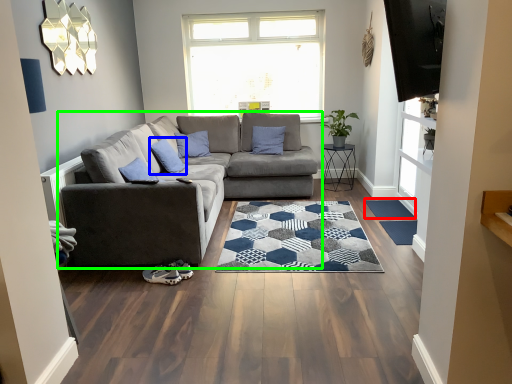
Question: Which is nearer to the flat (highlighted by a red box)? pillow (highlighted by a blue box) or studio couch (highlighted by a green box).

Choices:
 (A) pillow
 (B) studio couch

Answer: (B)